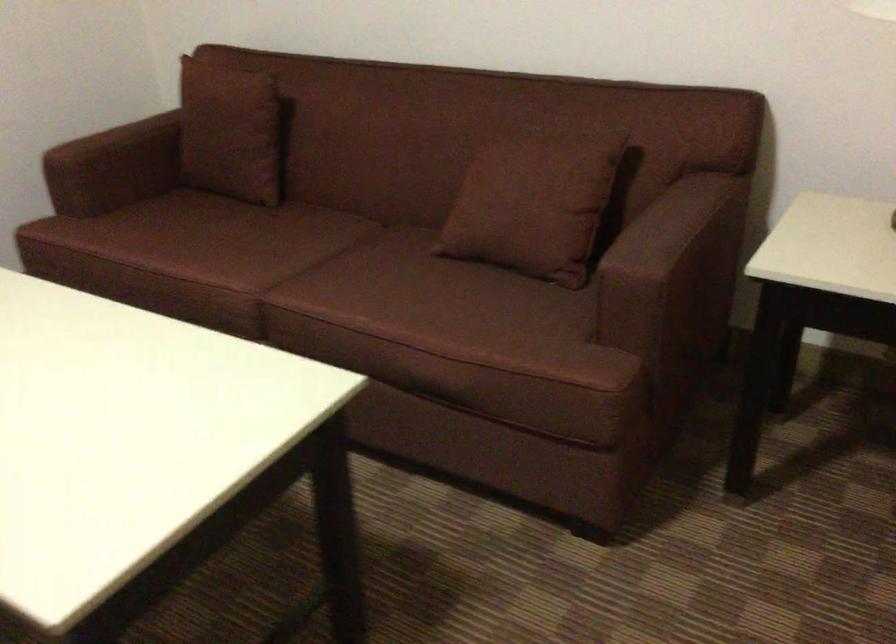
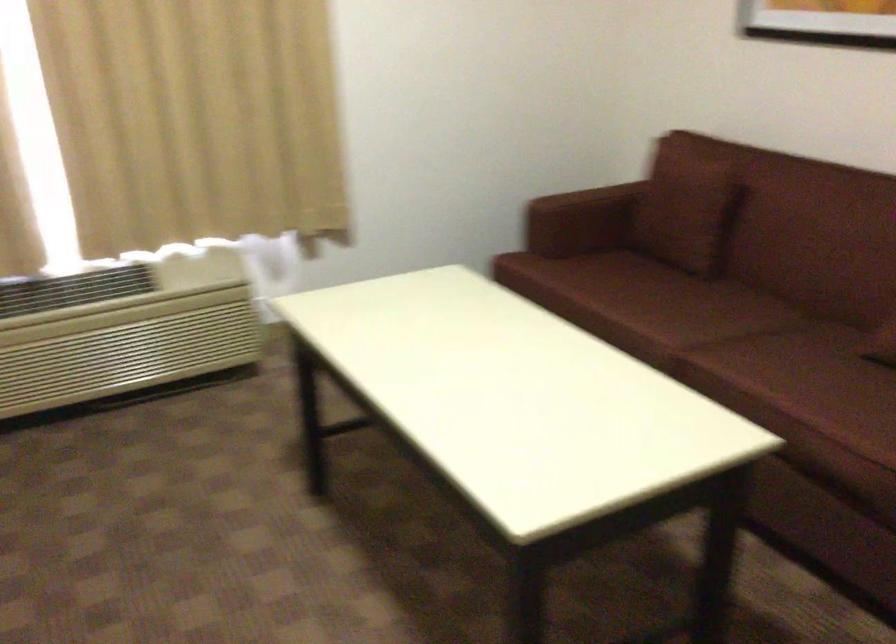
Question: The camera is either moving clockwise (left) or counter-clockwise (right) around the object. The first image is from the beginning of the video and the second image is from the end. Is the camera moving left or right when shooting the video?

Choices:
 (A) Left
 (B) Right

Answer: (B)